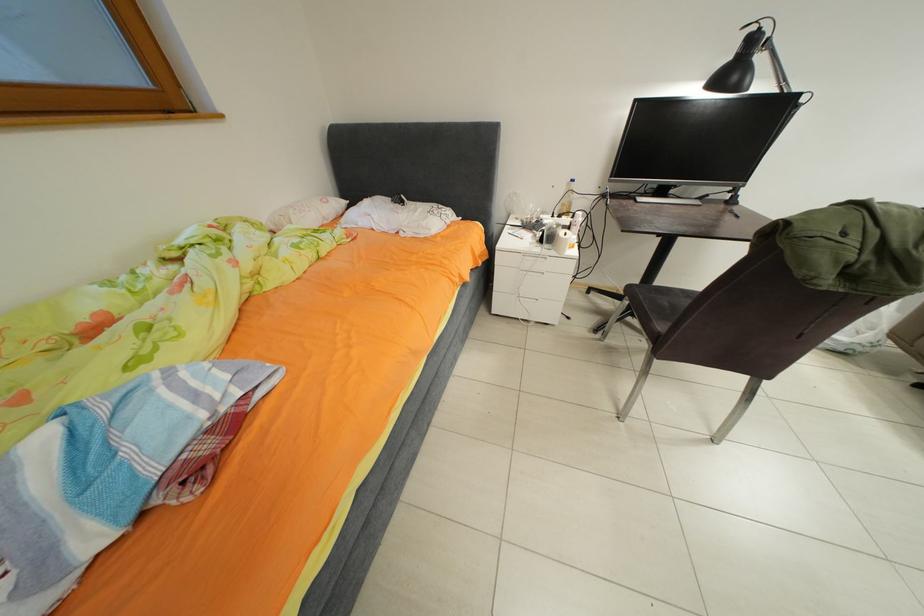
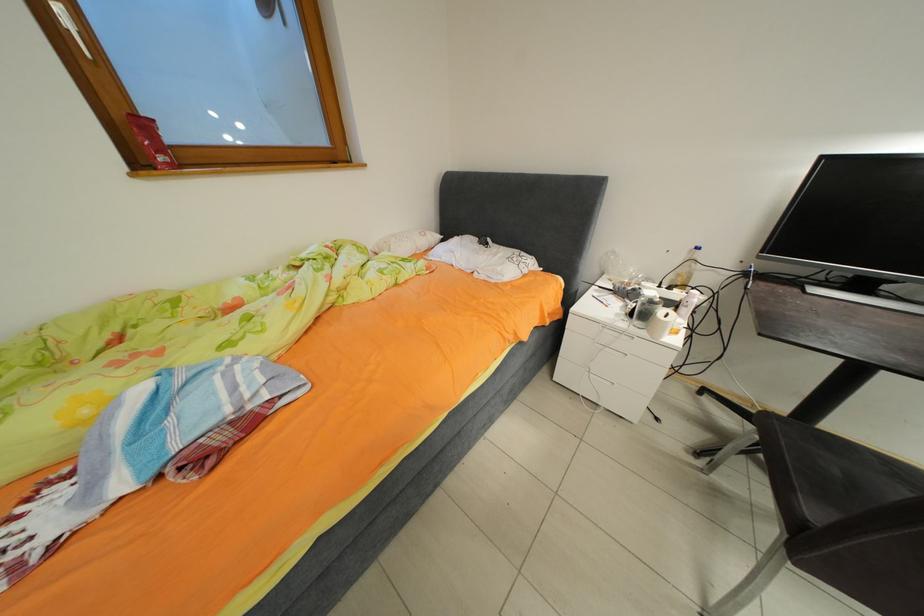
The images are taken continuously from a first-person perspective. In which direction are you moving?

The cameraman walked toward right, forward.